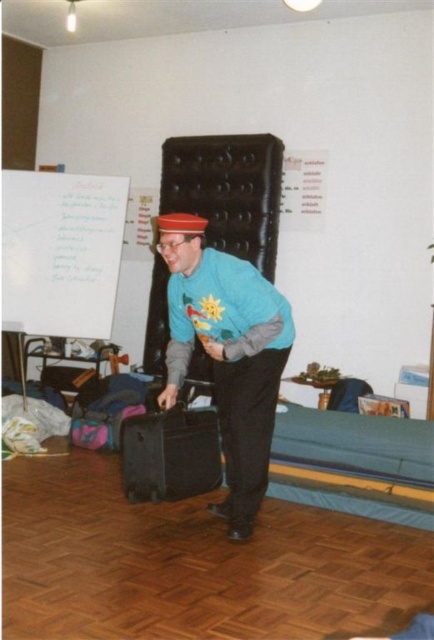
Question: Which point is farther to the camera?

Choices:
 (A) (114, 289)
 (B) (200, 492)
 (C) (272, 371)

Answer: (A)

Question: Is white paper at upper left to the left of black hard suitcase at center from the viewer's perspective?

Choices:
 (A) no
 (B) yes

Answer: (B)

Question: Is white paper at upper left to the right of black hard suitcase at center from the viewer's perspective?

Choices:
 (A) yes
 (B) no

Answer: (B)

Question: Among these objects, which one is nearest to the camera?

Choices:
 (A) matte blue sweater at center
 (B) white paper at upper left
 (C) black hard suitcase at center

Answer: (A)

Question: Which point is closer to the camera?

Choices:
 (A) matte blue sweater at center
 (B) white paper at upper left

Answer: (A)

Question: In this image, where is matte blue sweater at center located relative to black hard suitcase at center?

Choices:
 (A) right
 (B) left

Answer: (A)